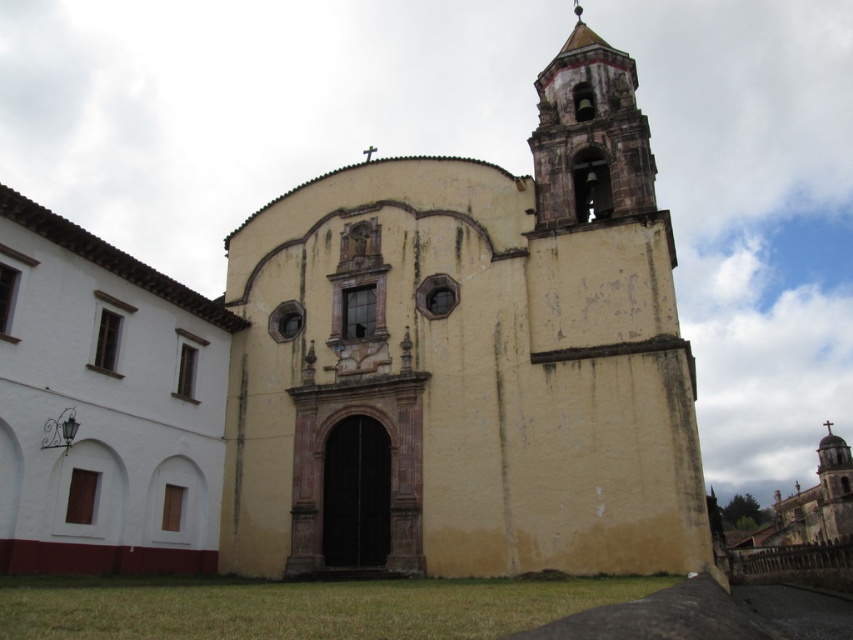
Which is above, yellow matte church at center or white matte building at left?

yellow matte church at center is above.

Is yellow matte church at center bigger than white matte building at left?

Correct, yellow matte church at center is larger in size than white matte building at left.

This screenshot has height=640, width=853. Identify the location of yellow matte church at center. (469, 358).